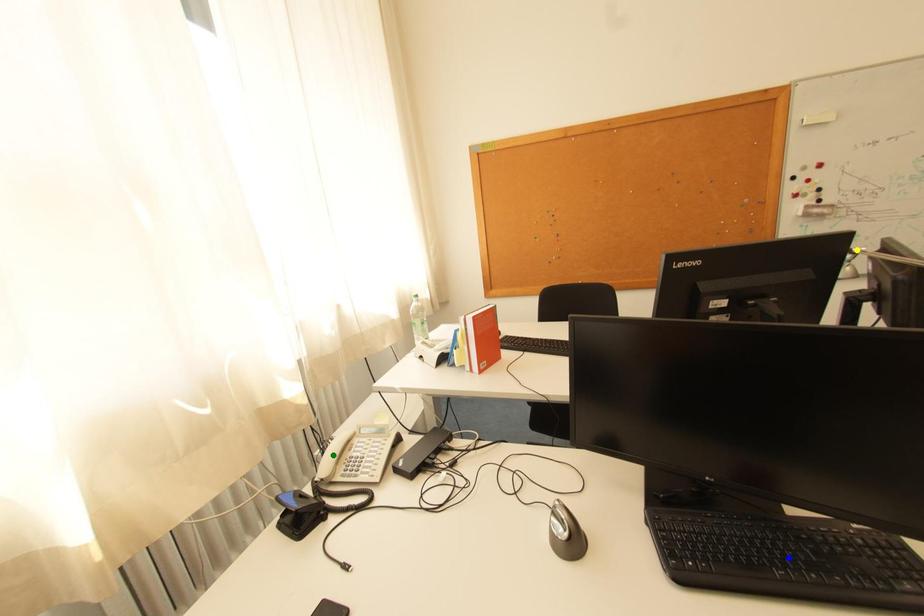
Order these from farthest to nearest:
yellow point | green point | blue point

yellow point, green point, blue point